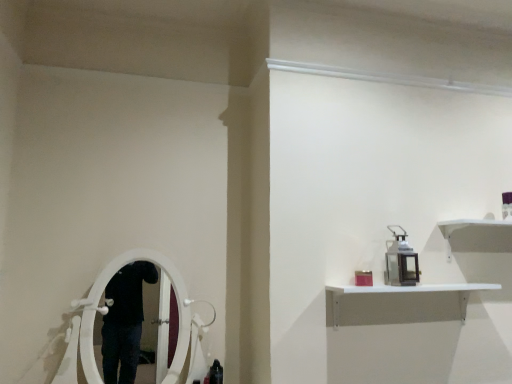
Question: Is white matte shelf at upper right at the back of metal lantern at upper right?

Choices:
 (A) yes
 (B) no

Answer: (B)

Question: Is metal lantern at upper right not near white matte shelf at upper right?

Choices:
 (A) no
 (B) yes

Answer: (A)

Question: Does metal lantern at upper right have a lesser width compared to white matte shelf at upper right?

Choices:
 (A) yes
 (B) no

Answer: (A)

Question: Is metal lantern at upper right shorter than white matte shelf at upper right?

Choices:
 (A) no
 (B) yes

Answer: (A)

Question: Could you tell me if metal lantern at upper right is turned towards white matte shelf at upper right?

Choices:
 (A) no
 (B) yes

Answer: (A)

Question: Is metal lantern at upper right next to white matte shelf at upper right and touching it?

Choices:
 (A) yes
 (B) no

Answer: (B)

Question: From the image's perspective, is white matte shelf at upper right located above metal lantern at upper right?

Choices:
 (A) yes
 (B) no

Answer: (B)

Question: From a real-world perspective, is white matte shelf at upper right below metal lantern at upper right?

Choices:
 (A) yes
 (B) no

Answer: (A)

Question: Is white matte shelf at upper right positioned behind metal lantern at upper right?

Choices:
 (A) no
 (B) yes

Answer: (A)

Question: Is white matte shelf at upper right located outside metal lantern at upper right?

Choices:
 (A) no
 (B) yes

Answer: (B)

Question: Is white matte shelf at upper right not close to metal lantern at upper right?

Choices:
 (A) yes
 (B) no

Answer: (B)

Question: Is white matte shelf at upper right at the left side of metal lantern at upper right?

Choices:
 (A) yes
 (B) no

Answer: (B)

Question: Would you say metal lantern at upper right is inside or outside white matte shelf at upper right?

Choices:
 (A) outside
 (B) inside

Answer: (A)